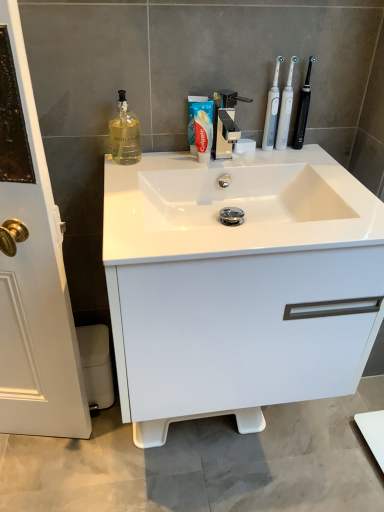
Image resolution: width=384 pixels, height=512 pixels. In order to click on free space in front of translucent glass bottle at upper left in this screenshot , I will do `click(122, 180)`.